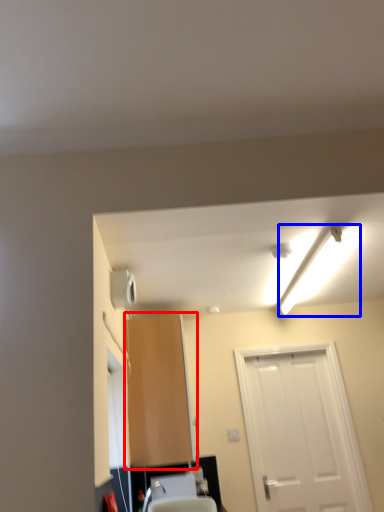
Question: Which of the following is the farthest to the observer, cabinetry (highlighted by a red box) or light fixture (highlighted by a blue box)?

Choices:
 (A) cabinetry
 (B) light fixture

Answer: (A)